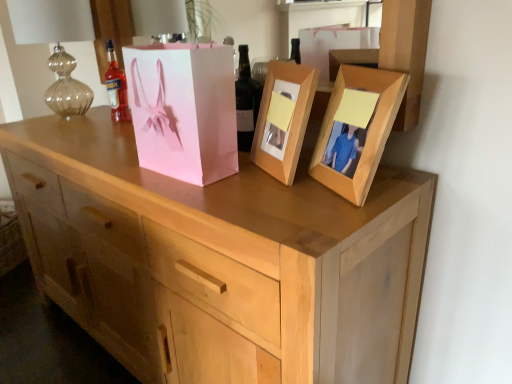
What are the coordinates of `free region on the left part of translucent glass bottle at upper left, which is counted as the first bottle, starting from the left` in the screenshot? It's located at (78, 129).